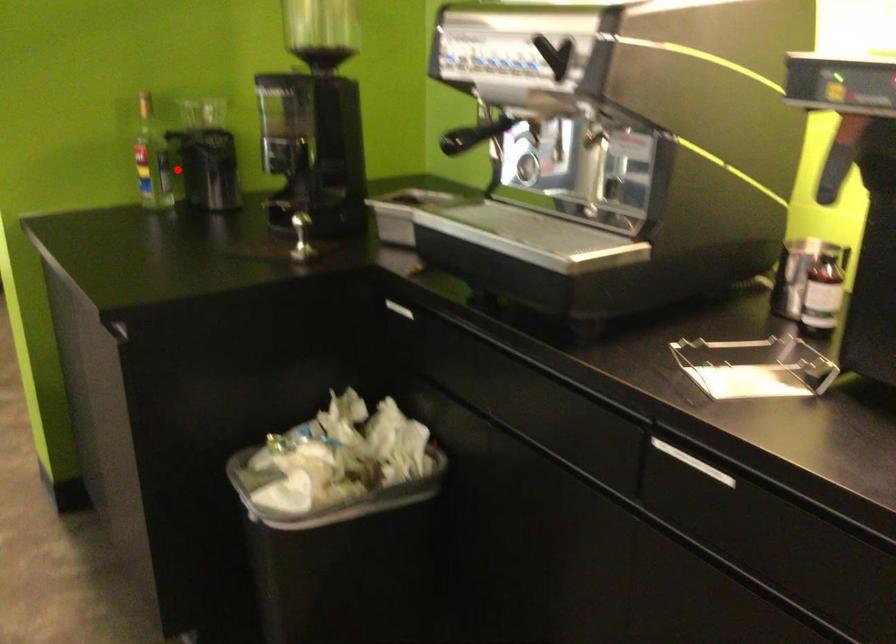
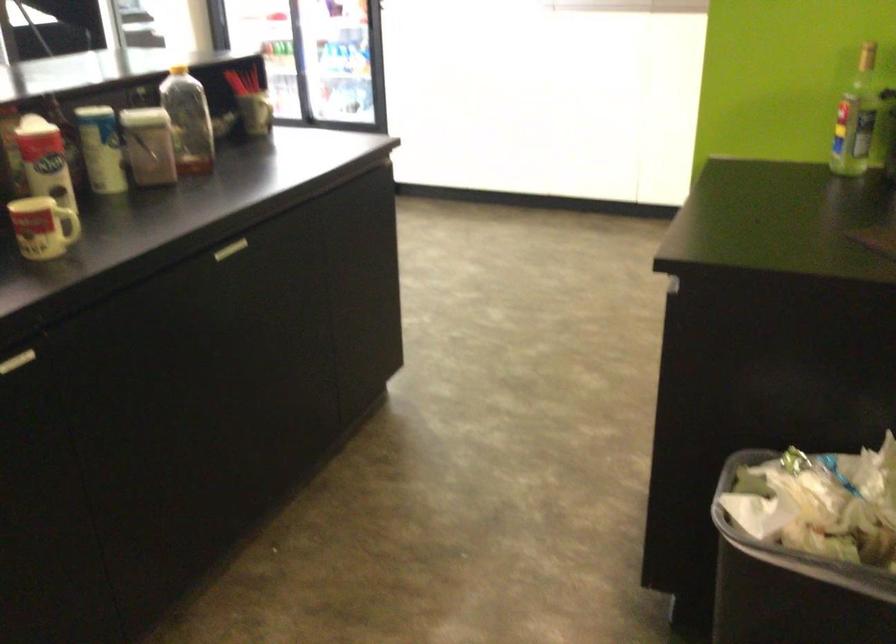
Question: A red point is marked in image1. In image2, is the corresponding 3D point closer to the camera or farther? Reply with the corresponding letter.

Choices:
 (A) The corresponding 3D point is closer.
 (B) The corresponding 3D point is farther.

Answer: (A)